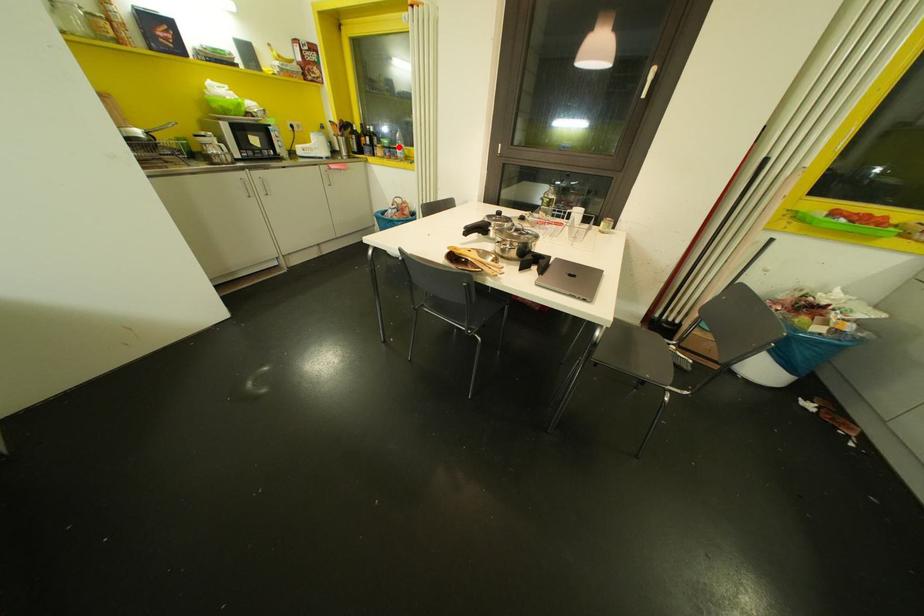
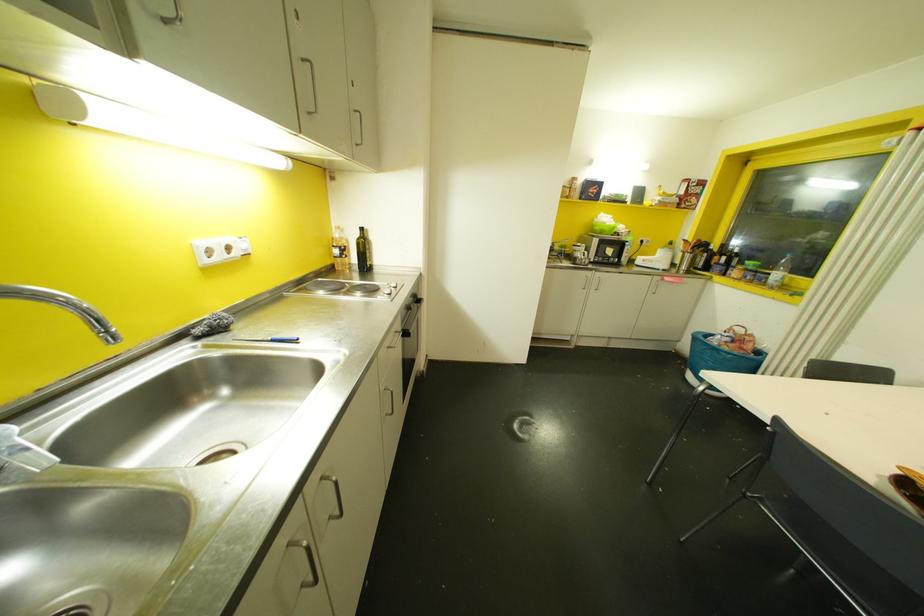
The point at the highlighted location is marked in the first image. Where is the corresponding point in the second image?

(776, 274)